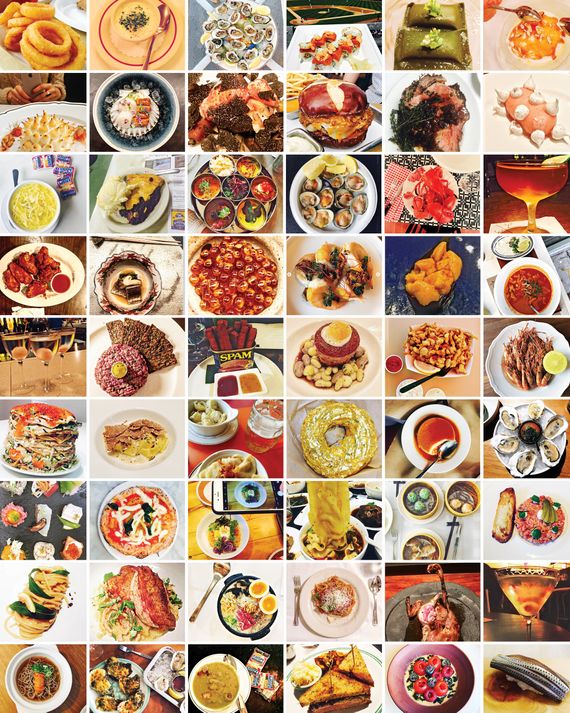
The height and width of the screenshot is (713, 570). Find the location of `photos containing silverware`. photos containing silverware is located at coordinates (149, 51), (515, 14), (536, 306), (431, 379), (433, 461), (209, 589), (372, 583), (232, 657), (142, 656), (454, 535).